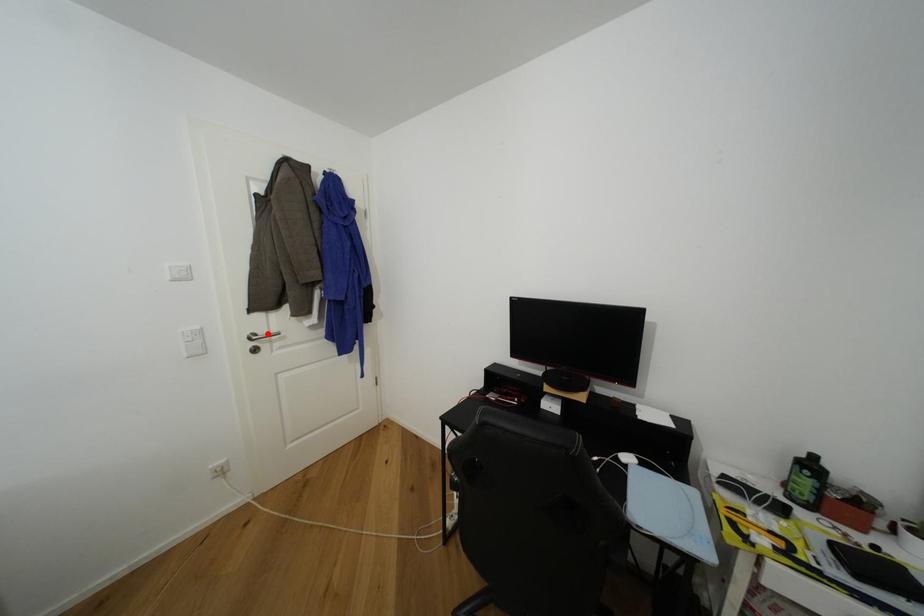
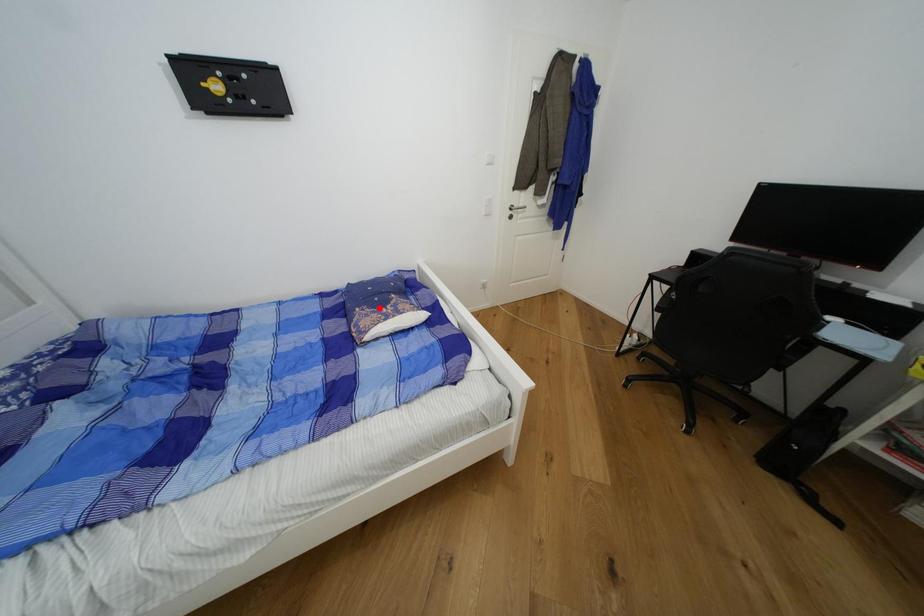
I am providing you with two images of the same scene from different viewpoints. A red point is marked on the first image and another point is marked on the second image. Is the red point in image1 aligned with the point shown in image2?

No